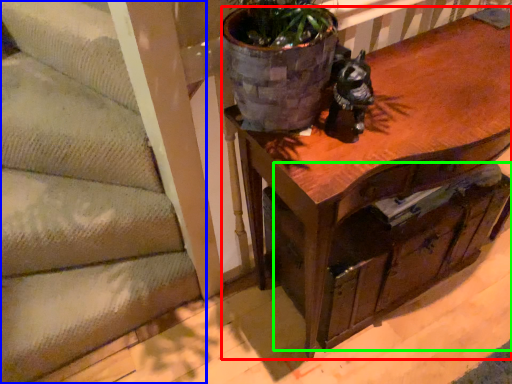
Question: Which object is positioned closest to table (highlighted by a red box)? Select from stairwell (highlighted by a blue box) and drawer (highlighted by a green box).

Choices:
 (A) stairwell
 (B) drawer

Answer: (B)